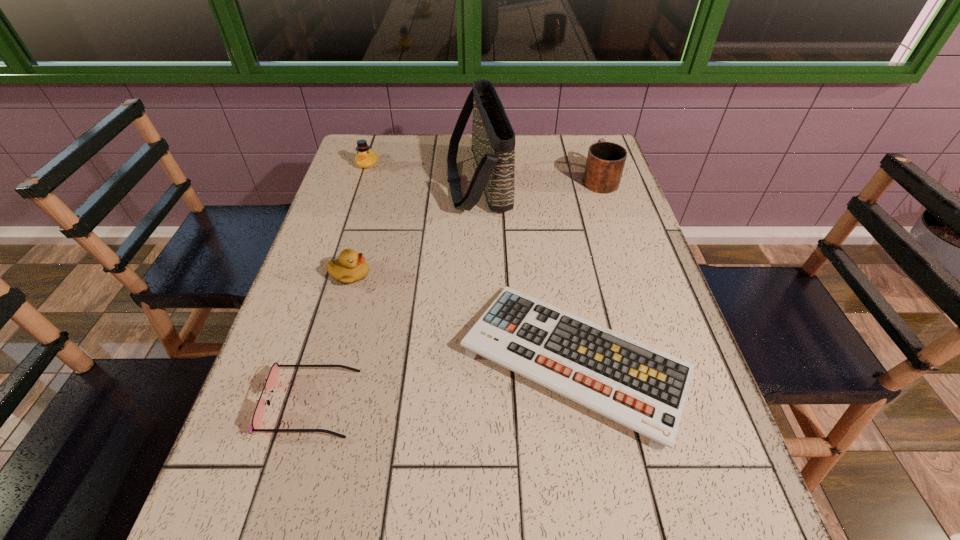
Where is `handbag`? handbag is located at coordinates (493, 139).

This screenshot has width=960, height=540. Find the location of `mug`. mug is located at coordinates (605, 162).

At what (x,y) coordinates should I click in order to perform the action: click on duck. Please return your answer as a coordinate pair (x, y). Image resolution: width=960 pixels, height=540 pixels. Looking at the image, I should click on (366, 157).

What are the coordinates of `duckling` in the screenshot? It's located at (351, 267).

This screenshot has height=540, width=960. Find the location of `sunglasses`. sunglasses is located at coordinates (272, 378).

Where is `the shortest object`? the shortest object is located at coordinates click(643, 388).

Locate an element on the screen. The height and width of the screenshot is (540, 960). vacant space located 0.100m on the left of the handbag is located at coordinates (413, 181).

Image resolution: width=960 pixels, height=540 pixels. Find the location of `free point located 0.190m on the side of the fifth shortest object with the handle`. free point located 0.190m on the side of the fifth shortest object with the handle is located at coordinates (585, 134).

I want to click on free space located on the front-facing side of the duck, so click(337, 258).

Where is `vacant space located 0.190m at the beak of the duckling`? The width and height of the screenshot is (960, 540). vacant space located 0.190m at the beak of the duckling is located at coordinates (447, 275).